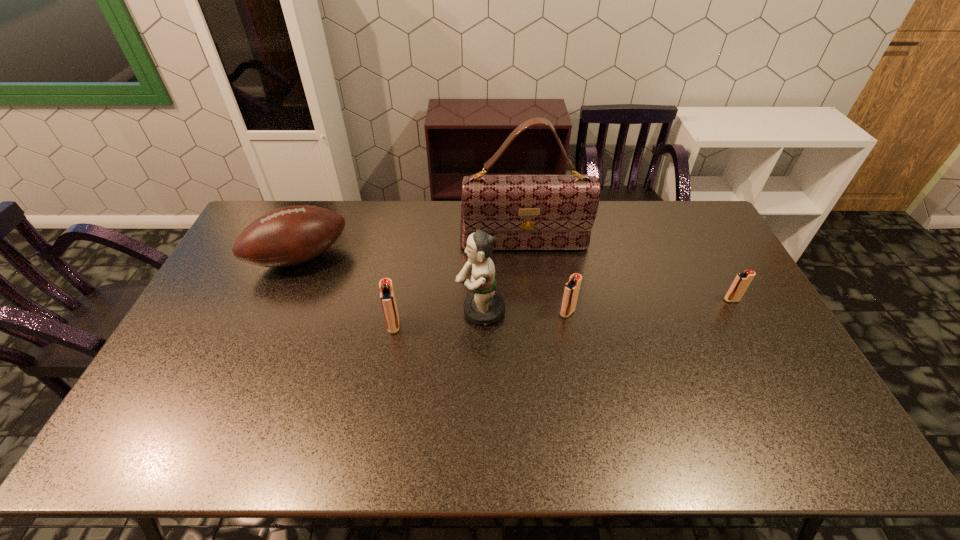
Please point a spot on the left to add another igniter. Please provide its 2D coordinates. Your answer should be formatted as a tuple, i.e. [(x, y)], where the tuple contains the x and y coordinates of a point satisfying the conditions above.

[(210, 340)]